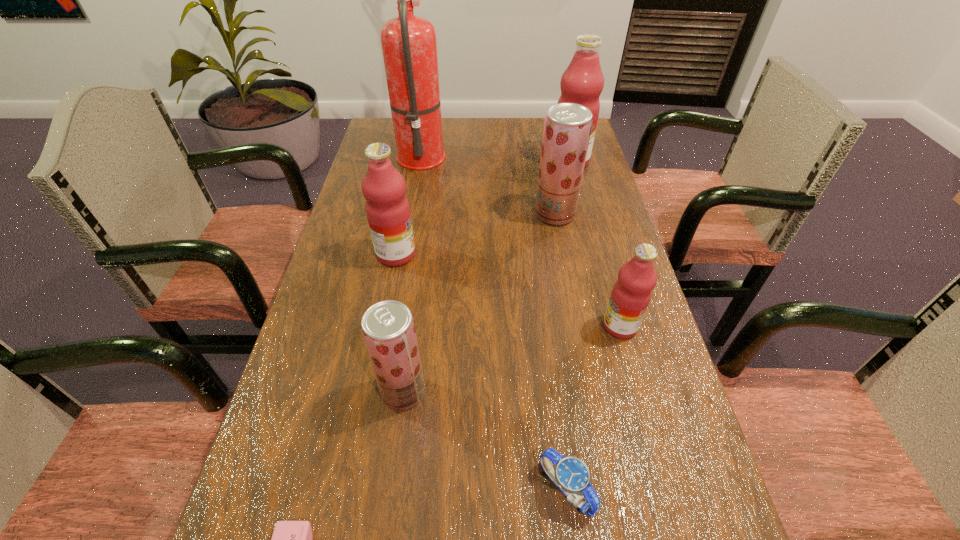
The width and height of the screenshot is (960, 540). I want to click on vacant region located on the label of the nearest pink fruit juice, so click(x=466, y=326).

Identify the location of free space located on the back of the smaller strawberry fruit juice. (410, 343).

Locate an element on the screen. The height and width of the screenshot is (540, 960). vacant space located 0.190m on the right of the seventh farthest object is located at coordinates (708, 489).

Image resolution: width=960 pixels, height=540 pixels. In order to click on fire extinguisher that is at the far edge in this screenshot , I will do `click(409, 46)`.

At what (x,y) coordinates should I click in order to perform the action: click on fruit juice that is positioned at the far edge. Please return your answer as a coordinate pair (x, y). This screenshot has width=960, height=540. Looking at the image, I should click on (582, 82).

At what (x,y) coordinates should I click in order to perform the action: click on fire extinguisher that is at the left edge. Please return your answer as a coordinate pair (x, y). This screenshot has width=960, height=540. Looking at the image, I should click on (409, 46).

The width and height of the screenshot is (960, 540). I want to click on fruit juice that is at the left edge, so click(x=388, y=212).

Image resolution: width=960 pixels, height=540 pixels. What are the coordinates of `object positioned at the far left corner` in the screenshot? It's located at (409, 46).

The image size is (960, 540). I want to click on object located in the far right corner section of the desktop, so click(x=582, y=82).

Find the location of `free spot at the far edge of the desktop`. free spot at the far edge of the desktop is located at coordinates (513, 137).